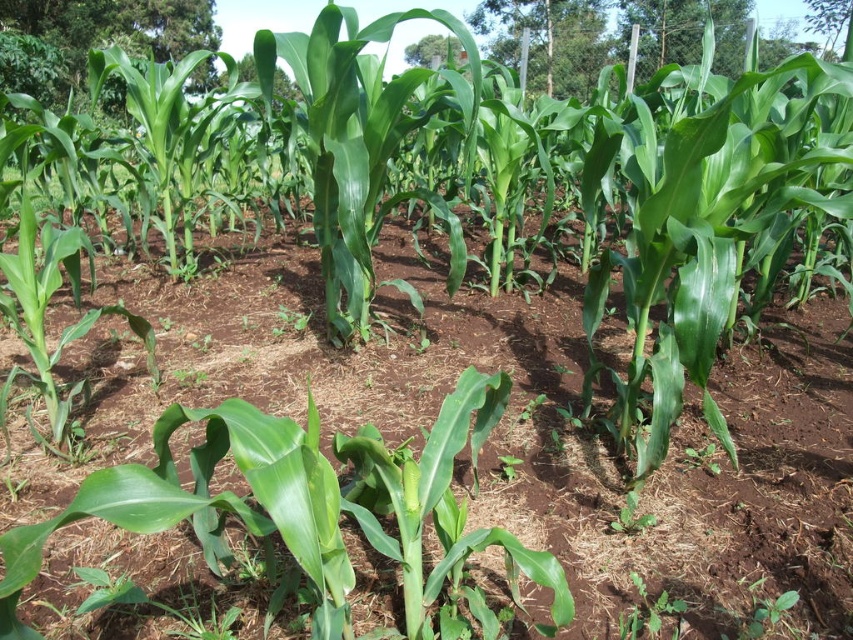
Is brown soil at center positioned behind green glossy corn at center?

No, brown soil at center is in front of green glossy corn at center.

Does point (64, 540) lie in front of point (412, 496)?

No, (64, 540) is further to viewer.

Between point (590, 472) and point (409, 492), which one is positioned in front?

Positioned in front is point (409, 492).

Identify the location of brown soil at center. The width and height of the screenshot is (853, 640). (442, 477).

Measure the distance from green leafy plant at lower center to green leafy plant at center.

green leafy plant at lower center is 9.44 inches away from green leafy plant at center.

Which is more to the right, green leafy plant at lower center or green leafy plant at center?

green leafy plant at center

The height and width of the screenshot is (640, 853). I want to click on green leafy plant at lower center, so click(650, 612).

The height and width of the screenshot is (640, 853). Find the location of `green leafy plant at lower center`. green leafy plant at lower center is located at coordinates (650, 612).

Find the location of a particular element. This screenshot has width=853, height=640. green leafy plant at center is located at coordinates pos(631,516).

Who is shorter, green leafy plant at center or green glossy corn at center?

With less height is green leafy plant at center.

Is point (621, 529) closer to camera compared to point (415, 490)?

No, (621, 529) is further to viewer.

The image size is (853, 640). Identify the location of green leafy plant at center. (631, 516).